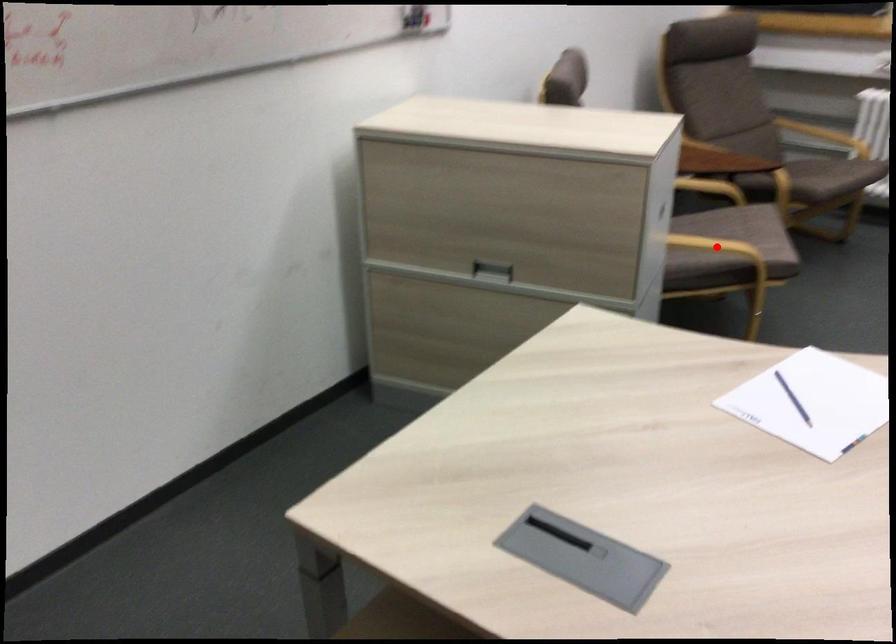
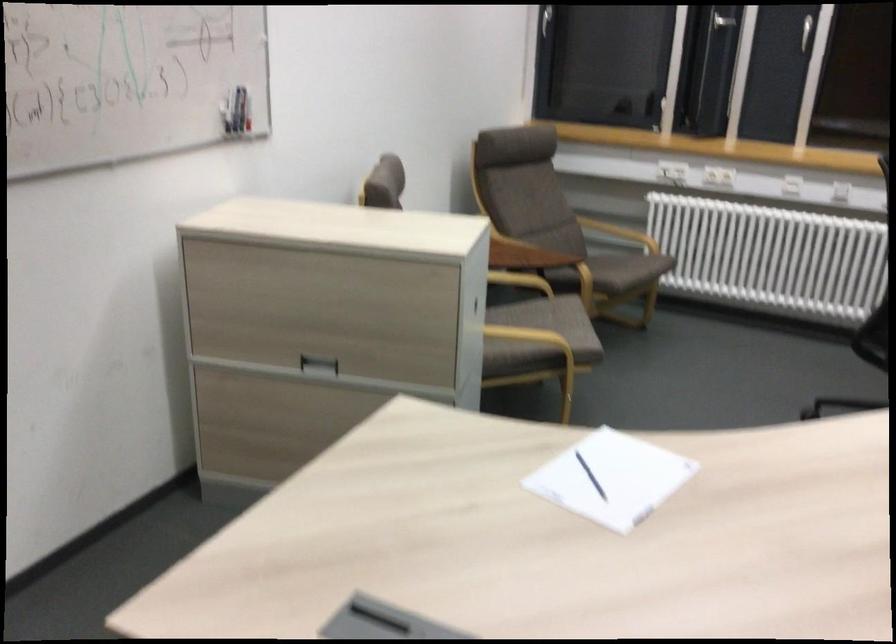
In the second image, find the point that corresponds to the highlighted location in the first image.

(528, 336)